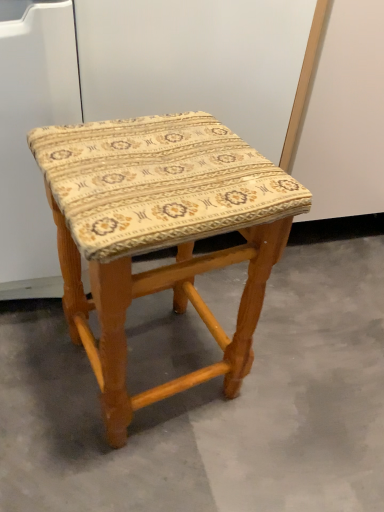
Where is `blank space above beige fabric stool at center (from a real-world perspective)`? The height and width of the screenshot is (512, 384). blank space above beige fabric stool at center (from a real-world perspective) is located at coordinates (253, 351).